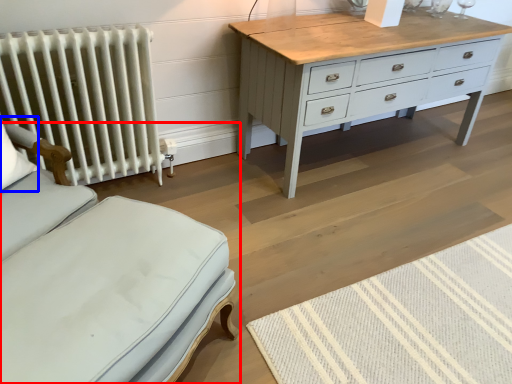
Question: Which object appears closest to the camera in this image, furniture (highlighted by a red box) or pillow (highlighted by a blue box)?

Choices:
 (A) furniture
 (B) pillow

Answer: (A)